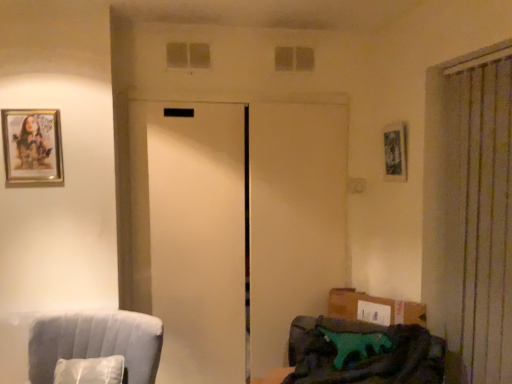
Question: Is metallic silver picture frame at upper right, the 1th picture frame in the back-to-front sequence, wider or thinner than gold-framed picture at upper left, which is the 1th picture frame in left-to-right order?

Choices:
 (A) thin
 (B) wide

Answer: (B)

Question: Is metallic silver picture frame at upper right, which is the 2th picture frame in front-to-back order, taller or shorter than gold-framed picture at upper left, which is the second picture frame in right-to-left order?

Choices:
 (A) tall
 (B) short

Answer: (B)

Question: Which of these objects is positioned closest to the gold-framed picture at upper left, which is the second picture frame in right-to-left order?

Choices:
 (A) white sheer curtain at right
 (B) teal fabric couch at lower right, which ranks as the first furniture in right-to-left order
 (C) clear glass window at upper center, which is the first window from front to back
 (D) translucent glass window at upper center, positioned as the 2th window in left-to-right order
 (E) green fabric pillow at lower right

Answer: (C)

Question: Which object is positioned closest to the translucent glass window at upper center, which is counted as the 2th window, starting from the front?

Choices:
 (A) gold-framed picture at upper left, which is the second picture frame in right-to-left order
 (B) clear glass window at upper center, which is counted as the first window, starting from the left
 (C) metallic silver picture frame at upper right, the first picture frame when ordered from right to left
 (D) white sheer curtain at right
 (E) white matte elevator at center

Answer: (B)